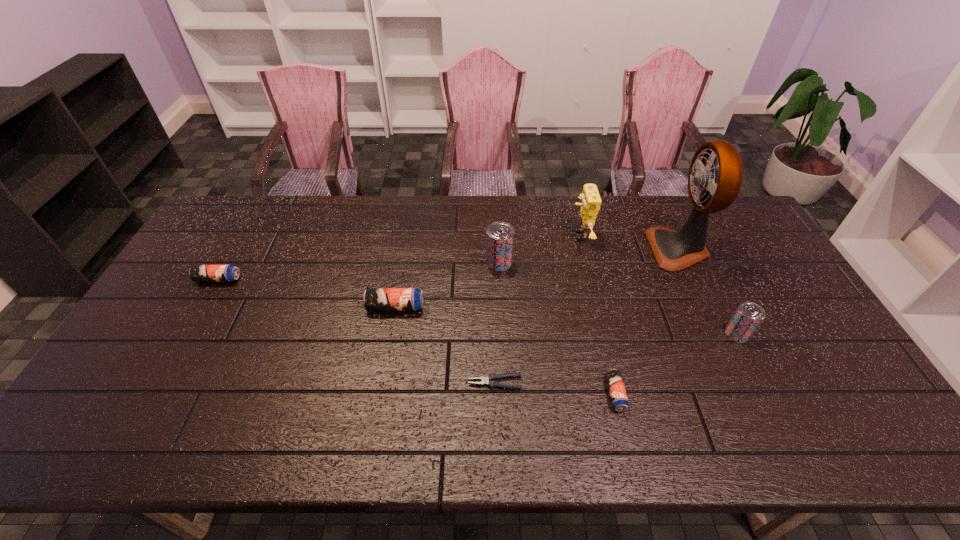
The image size is (960, 540). I want to click on the tallest object, so click(x=674, y=250).

You are a GUI agent. You are given a task and a screenshot of the screen. Output one action in this format:
    pyautogui.click(x=<x>, y=<y>)
    Task: Click on the fan
    Image resolution: width=960 pixels, height=540 pixels.
    Given the screenshot: What is the action you would take?
    pyautogui.click(x=674, y=250)

Locate an element on the screen. Image resolution: width=960 pixels, height=540 pixels. sponge is located at coordinates (591, 201).

At what (x,y) coordinates should I click in order to perform the action: click on the tallest beer can. Please return your answer as a coordinate pair (x, y). Looking at the image, I should click on (499, 235).

The height and width of the screenshot is (540, 960). What are the coordinates of `the farther red beer can` in the screenshot? It's located at (499, 235).

Find the location of `the nearer red beer can`. the nearer red beer can is located at coordinates (748, 316).

The image size is (960, 540). I want to click on the sixth farthest object, so click(748, 316).

Identify the location of the fourth beer can from right to left. (374, 299).

In order to click on the biggest blue beer can in this screenshot , I will do `click(374, 299)`.

Image resolution: width=960 pixels, height=540 pixels. In order to click on the leftmost blue beer can in this screenshot , I will do `click(198, 273)`.